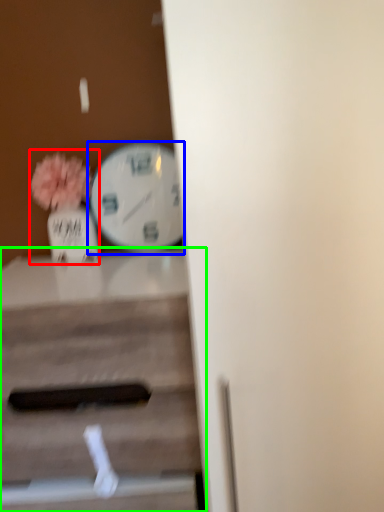
Question: Which object is positioned closest to floral arrangement (highlighted by a red box)? Select from wall clock (highlighted by a blue box) and table (highlighted by a green box).

Choices:
 (A) wall clock
 (B) table

Answer: (A)